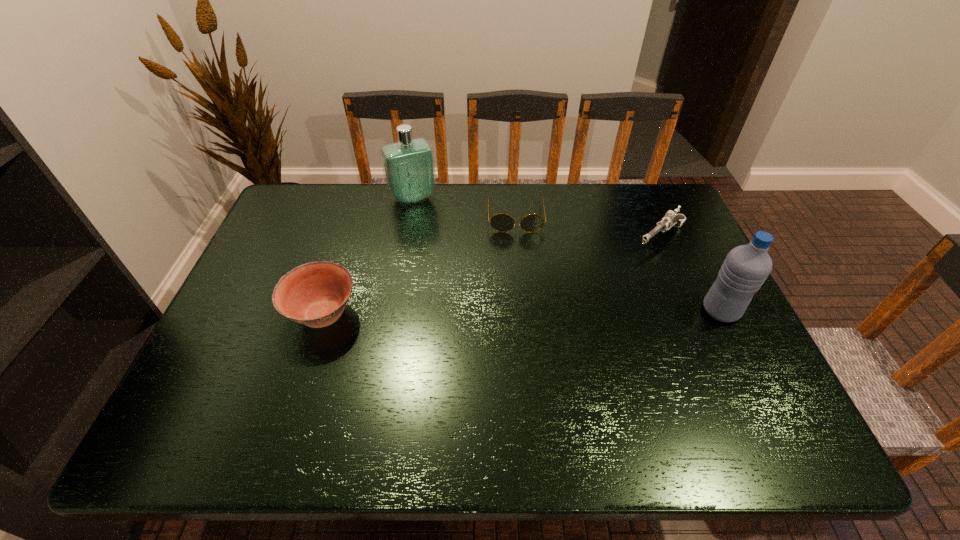
Find the location of a particular element. free spot on the desktop that is between the bowl and the water bottle and is positioned on the lenses of the sunglasses is located at coordinates (522, 313).

Where is `vacant spot on the desktop that is between the bowl and the water bottle and is positioned aimed along the barrel of the gun`? The height and width of the screenshot is (540, 960). vacant spot on the desktop that is between the bowl and the water bottle and is positioned aimed along the barrel of the gun is located at coordinates (571, 313).

Where is `vacant space on the desktop that is between the bowl and the water bottle and is positioned on the front label of the perfume`? vacant space on the desktop that is between the bowl and the water bottle and is positioned on the front label of the perfume is located at coordinates (474, 313).